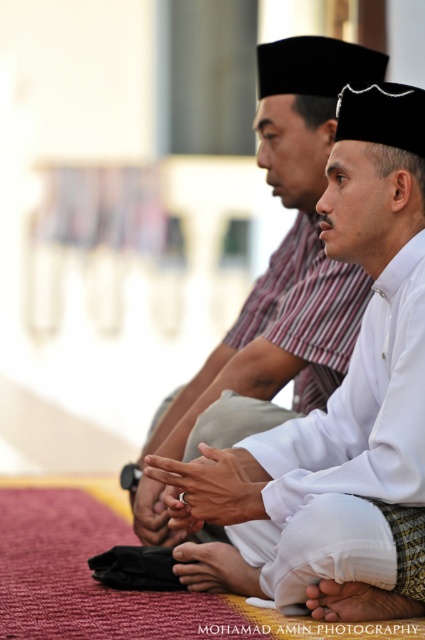
You are a photographer trying to capture a closeup of the white matte shirt at center and the white matte hand at lower center in the scene. Which object should you focus on first if you want to ensure both are in focus without adjusting the camera settings?

The white matte shirt at center is larger than the white matte hand at lower center, so focusing on the shirt first would help maintain focus on both since it is bigger and likely closer to the camera.